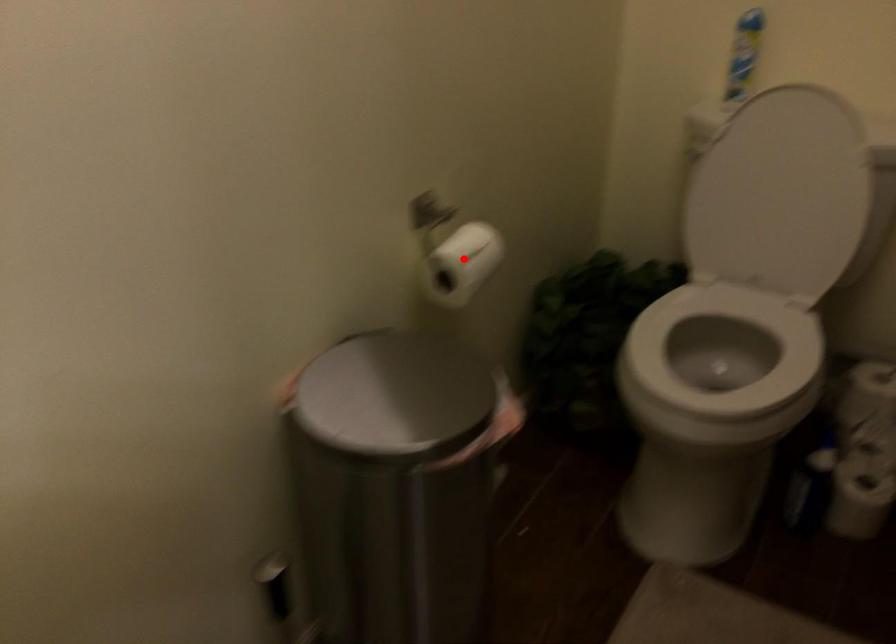
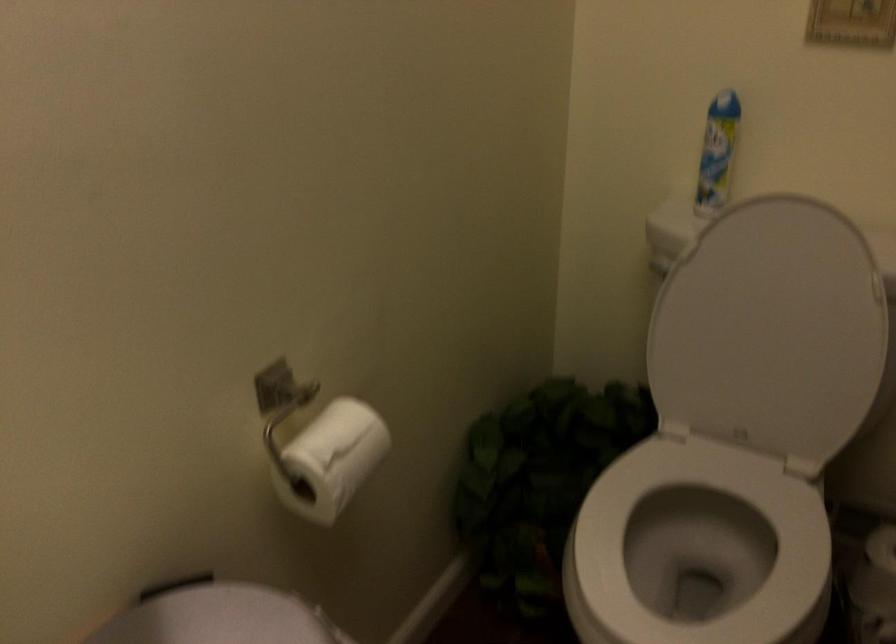
Where in the second image is the point corresponding to the highlighted location from the first image?

(331, 459)